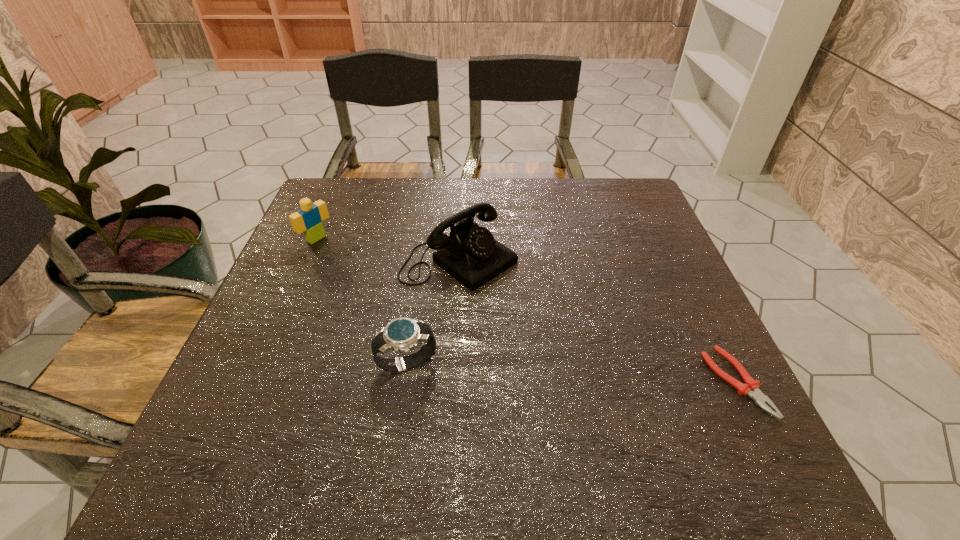
Where is `vacant space in between the rightmost object and the leftmost object`? This screenshot has height=540, width=960. vacant space in between the rightmost object and the leftmost object is located at coordinates (526, 310).

Where is `unoccupied area between the telephone and the Lego`? This screenshot has width=960, height=540. unoccupied area between the telephone and the Lego is located at coordinates (388, 249).

Identify the location of unoccupied position between the telephone and the Lego. (388, 249).

What are the coordinates of `object that is the second nearest to the pliers` in the screenshot? It's located at (402, 334).

Locate an element on the screen. The width and height of the screenshot is (960, 540). object that ranks as the third closest to the telephone is located at coordinates (751, 388).

Image resolution: width=960 pixels, height=540 pixels. What are the coordinates of `free space that satisfies the following two spatial constraints: 1. on the front side of the telephone; 2. on the right side of the Lego` in the screenshot? It's located at (307, 260).

The image size is (960, 540). I want to click on vacant region that satisfies the following two spatial constraints: 1. on the front side of the leftmost object; 2. on the left side of the second shortest object, so click(x=262, y=364).

Where is `vacant space that satisfies the following two spatial constraints: 1. on the front side of the leftmost object; 2. on the left side of the third tallest object`? vacant space that satisfies the following two spatial constraints: 1. on the front side of the leftmost object; 2. on the left side of the third tallest object is located at coordinates 262,364.

Locate an element on the screen. Image resolution: width=960 pixels, height=540 pixels. free space in the image that satisfies the following two spatial constraints: 1. on the front side of the telephone; 2. on the left side of the rightmost object is located at coordinates (453, 382).